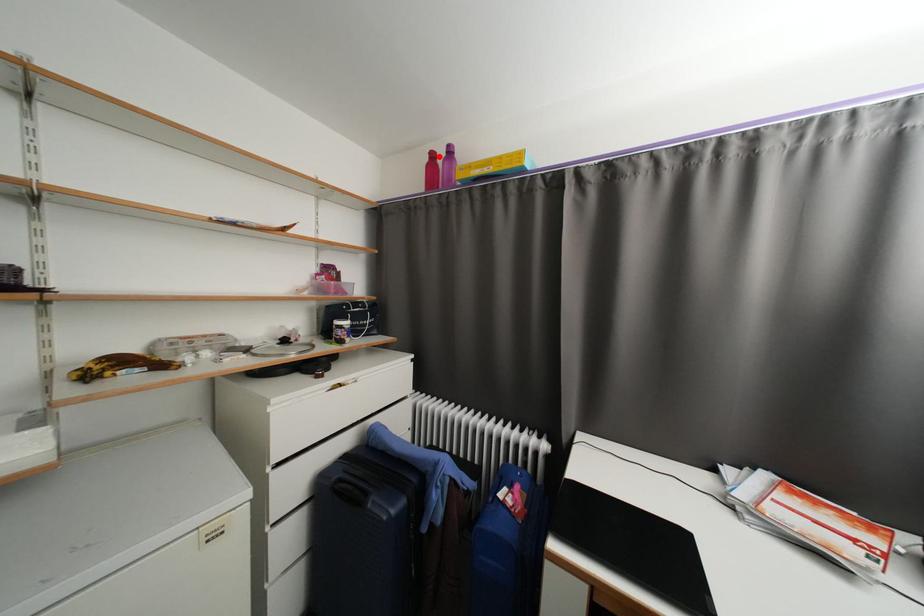
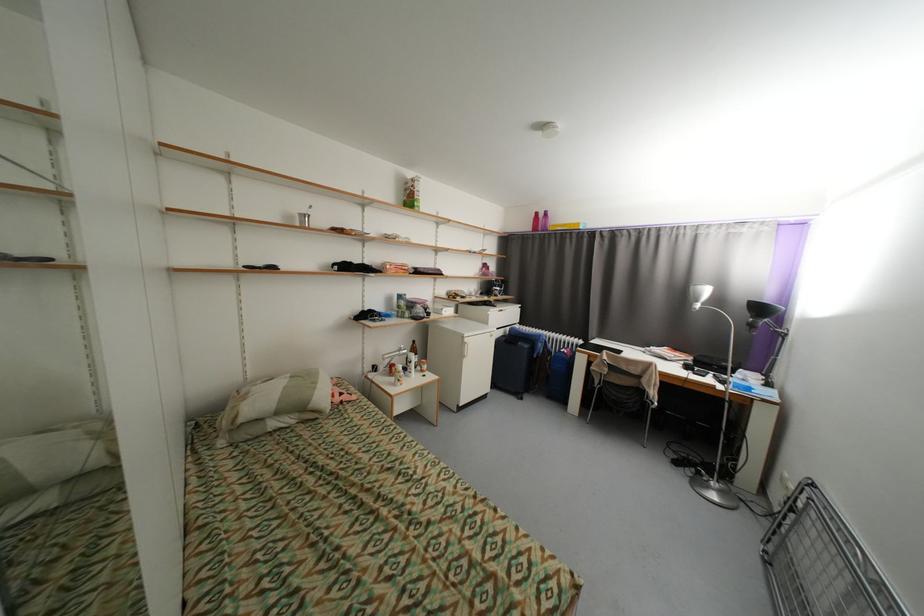
In the second image, find the point that corresponds to the highlighted location in the first image.

(542, 215)